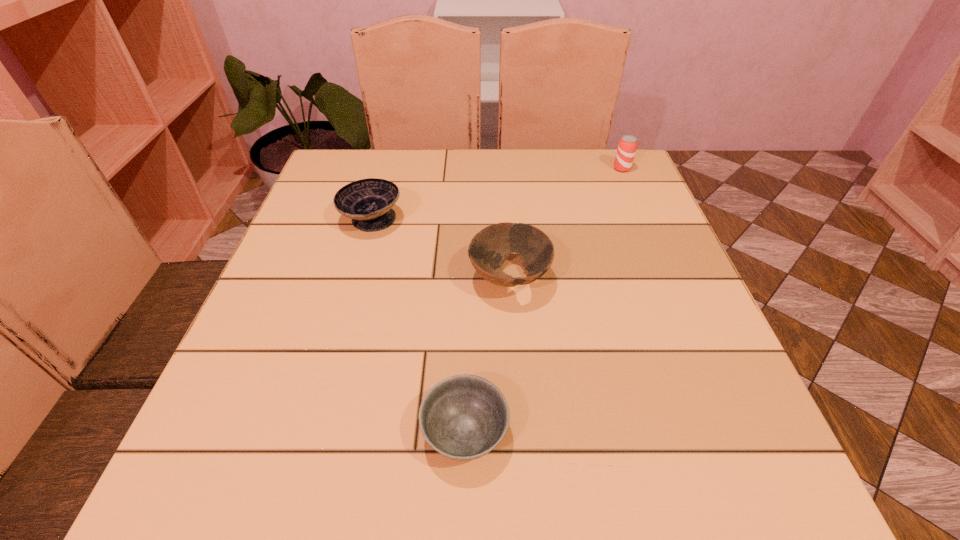
The image size is (960, 540). Identify the location of free space between the leftmost bowl and the rightmost object. (496, 194).

You are a GUI agent. You are given a task and a screenshot of the screen. Output one action in this format:
    pyautogui.click(x=<x>, y=<y>)
    Task: Click on the free space between the second nearest object and the nearest bowl
    The image size is (960, 540).
    Given the screenshot: What is the action you would take?
    pyautogui.click(x=488, y=356)

Identify the location of vacant area that lies between the second nearest bowl and the nearest object. pyautogui.click(x=488, y=356).

The height and width of the screenshot is (540, 960). Find the location of `object identified as the second closest to the beer can`. object identified as the second closest to the beer can is located at coordinates (368, 202).

Point out which object is positioned as the third nearest to the second farthest bowl. Please provide its 2D coordinates. Your answer should be formatted as a tuple, i.e. [(x, y)], where the tuple contains the x and y coordinates of a point satisfying the conditions above.

[(627, 145)]

Locate an element on the screen. bowl that is the second closest to the beer can is located at coordinates (368, 202).

Locate an element on the screen. This screenshot has width=960, height=540. bowl that stands as the second closest to the nearest bowl is located at coordinates (368, 202).

Identify the location of free space that satisfies the following two spatial constraints: 1. on the front side of the second farthest object; 2. on the left side of the shortest bowl. (311, 433).

You are a GUI agent. You are given a task and a screenshot of the screen. Output one action in this format:
    pyautogui.click(x=<x>, y=<y>)
    Task: Click on the free location that satisfies the following two spatial constraints: 1. on the back side of the leftmost bowl; 2. on the left side of the rightmost object
    The width and height of the screenshot is (960, 540).
    Given the screenshot: What is the action you would take?
    pyautogui.click(x=386, y=168)

Image resolution: width=960 pixels, height=540 pixels. Find the location of `vacant area that satisfies the following two spatial constraints: 1. on the front side of the shortest bowl; 2. on the right side of the farthest bowl`. vacant area that satisfies the following two spatial constraints: 1. on the front side of the shortest bowl; 2. on the right side of the farthest bowl is located at coordinates (311, 433).